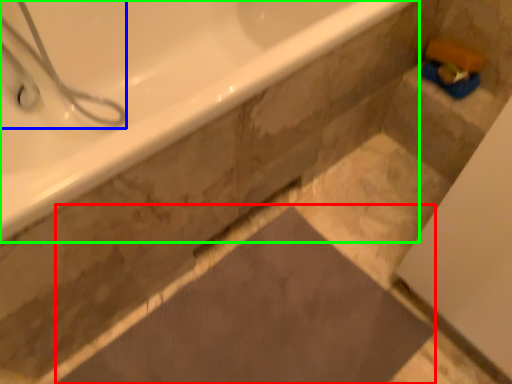
Question: Considering the real-world distances, which object is farthest from bath mat (highlighted by a red box)? shower (highlighted by a blue box) or bathtub (highlighted by a green box)?

Choices:
 (A) shower
 (B) bathtub

Answer: (A)